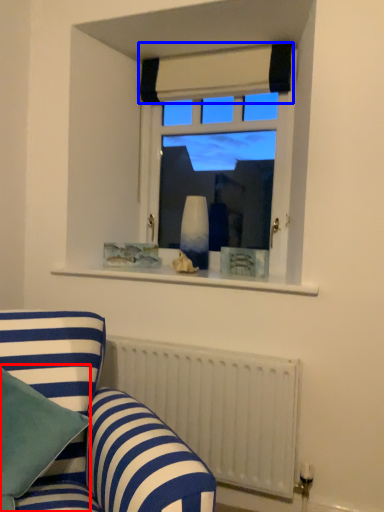
Question: Which point is closer to the camera, pillow (highlighted by a red box) or curtain (highlighted by a blue box)?

Choices:
 (A) pillow
 (B) curtain

Answer: (A)